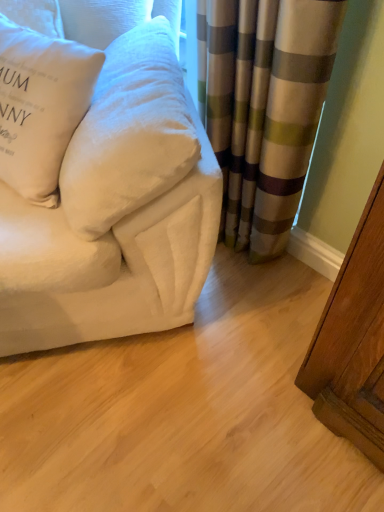
Identify the location of white velvety pillow at left, positioned as the 2th pillow in left-to-right order. Image resolution: width=384 pixels, height=512 pixels. (129, 133).

What is the approximate height of white soft pillow at upper left, which is the 1th pillow from left to right?

42.15 centimeters.

Find the location of a particular element. The width and height of the screenshot is (384, 512). white velvety pillow at left, which appears as the 1th pillow when viewed from the right is located at coordinates (129, 133).

Which is nearer, (293,69) or (3,261)?

Clearly, point (293,69) is more distant from the camera than point (3,261).

Is striped fabric curtain at center positioned behind white velvety couch at upper left?

Yes, it is.

From the image's perspective, is striped fabric curtain at center beneath white velvety couch at upper left?

Correct, striped fabric curtain at center appears lower than white velvety couch at upper left in the image.

Is striped fabric curtain at center to the left of white velvety couch at upper left from the viewer's perspective?

In fact, striped fabric curtain at center is to the right of white velvety couch at upper left.

From the image's perspective, is white velvety pillow at left, positioned as the 2th pillow in left-to-right order, below striped fabric curtain at center?

Yes, from the image's perspective, white velvety pillow at left, positioned as the 2th pillow in left-to-right order, is beneath striped fabric curtain at center.

Consider the image. Which object is wider, white velvety pillow at left, which appears as the 1th pillow when viewed from the right, or striped fabric curtain at center?

white velvety pillow at left, which appears as the 1th pillow when viewed from the right.

Is white velvety couch at upper left taller than white velvety pillow at left, positioned as the 2th pillow in left-to-right order?

Yes.

Is white velvety couch at upper left outside of white velvety pillow at left, positioned as the 2th pillow in left-to-right order?

Yes, white velvety couch at upper left is outside of white velvety pillow at left, positioned as the 2th pillow in left-to-right order.

How far apart are white velvety couch at upper left and white velvety pillow at left, positioned as the 2th pillow in left-to-right order?

The distance of white velvety couch at upper left from white velvety pillow at left, positioned as the 2th pillow in left-to-right order, is 3.25 inches.

In terms of width, does white velvety couch at upper left look wider or thinner when compared to white velvety pillow at left, positioned as the 2th pillow in left-to-right order?

Clearly, white velvety couch at upper left has more width compared to white velvety pillow at left, positioned as the 2th pillow in left-to-right order.

Is white velvety couch at upper left positioned with its back to striped fabric curtain at center?

No, white velvety couch at upper left's orientation is not away from striped fabric curtain at center.

Is white velvety couch at upper left shorter than striped fabric curtain at center?

In fact, white velvety couch at upper left may be taller than striped fabric curtain at center.

From a real-world perspective, who is located higher, white velvety couch at upper left or striped fabric curtain at center?

In real-world perspective, white velvety couch at upper left is above.

Between white velvety couch at upper left and striped fabric curtain at center, which one has larger width?

Wider between the two is white velvety couch at upper left.

Is white velvety pillow at left, which appears as the 1th pillow when viewed from the right, touching white velvety couch at upper left?

Yes, white velvety pillow at left, which appears as the 1th pillow when viewed from the right, is with white velvety couch at upper left.

Consider the image. Does white velvety pillow at left, which appears as the 1th pillow when viewed from the right, come in front of white velvety couch at upper left?

No, it is not.

From the image's perspective, is white velvety pillow at left, positioned as the 2th pillow in left-to-right order, located above white velvety couch at upper left?

No, from the image's perspective, white velvety pillow at left, positioned as the 2th pillow in left-to-right order, is not on top of white velvety couch at upper left.

From the picture: Can you confirm if white velvety pillow at left, positioned as the 2th pillow in left-to-right order, is bigger than white velvety couch at upper left?

Actually, white velvety pillow at left, positioned as the 2th pillow in left-to-right order, might be smaller than white velvety couch at upper left.

In terms of width, does striped fabric curtain at center look wider or thinner when compared to white soft pillow at upper left, marked as the 2th pillow in a right-to-left arrangement?

Clearly, striped fabric curtain at center has less width compared to white soft pillow at upper left, marked as the 2th pillow in a right-to-left arrangement.

Which pillow is the 1st one when counting from the front of the striped fabric curtain at center? Please provide its 2D coordinates.

[(40, 106)]

Does striped fabric curtain at center have a larger size compared to white soft pillow at upper left, marked as the 2th pillow in a right-to-left arrangement?

Correct, striped fabric curtain at center is larger in size than white soft pillow at upper left, marked as the 2th pillow in a right-to-left arrangement.

How many degrees apart are the facing directions of striped fabric curtain at center and white soft pillow at upper left, which is the 1th pillow from left to right?

striped fabric curtain at center and white soft pillow at upper left, which is the 1th pillow from left to right, are facing 8.65 degrees away from each other.

From a real-world perspective, which object rests below the other?

white velvety pillow at left, positioned as the 2th pillow in left-to-right order, from a real-world perspective.

Is white velvety pillow at left, which appears as the 1th pillow when viewed from the right, at the back of white soft pillow at upper left, which is the 1th pillow from left to right?

Yes, white soft pillow at upper left, which is the 1th pillow from left to right,'s orientation is away from white velvety pillow at left, which appears as the 1th pillow when viewed from the right.

Looking at this image, which is behind, white soft pillow at upper left, which is the 1th pillow from left to right, or white velvety pillow at left, which appears as the 1th pillow when viewed from the right?

white soft pillow at upper left, which is the 1th pillow from left to right, is further away from the camera.

From the image's perspective, is white soft pillow at upper left, which is the 1th pillow from left to right, located beneath white velvety pillow at left, positioned as the 2th pillow in left-to-right order?

No.

Locate an element on the screen. The height and width of the screenshot is (512, 384). curtain on the right of white velvety couch at upper left is located at coordinates (264, 106).

Locate an element on the screen. This screenshot has width=384, height=512. the 2nd pillow in front of the striped fabric curtain at center is located at coordinates (129, 133).

Estimate the real-world distances between objects in this image. Which object is further from white soft pillow at upper left, which is the 1th pillow from left to right, striped fabric curtain at center or white velvety couch at upper left?

Among the two, striped fabric curtain at center is located further to white soft pillow at upper left, which is the 1th pillow from left to right.

Estimate the real-world distances between objects in this image. Which object is further from striped fabric curtain at center, white velvety pillow at left, positioned as the 2th pillow in left-to-right order, or white velvety couch at upper left?

white velvety couch at upper left is positioned further to the anchor striped fabric curtain at center.

In the scene shown: From the image, which object appears to be farther from white velvety pillow at left, positioned as the 2th pillow in left-to-right order, white velvety couch at upper left or white soft pillow at upper left, marked as the 2th pillow in a right-to-left arrangement?

white soft pillow at upper left, marked as the 2th pillow in a right-to-left arrangement, lies further to white velvety pillow at left, positioned as the 2th pillow in left-to-right order, than the other object.

In the scene shown: Based on their spatial positions, is white velvety pillow at left, which appears as the 1th pillow when viewed from the right, or striped fabric curtain at center closer to white soft pillow at upper left, marked as the 2th pillow in a right-to-left arrangement?

white velvety pillow at left, which appears as the 1th pillow when viewed from the right, is closer to white soft pillow at upper left, marked as the 2th pillow in a right-to-left arrangement.

Based on their spatial positions, is white soft pillow at upper left, marked as the 2th pillow in a right-to-left arrangement, or striped fabric curtain at center closer to white velvety couch at upper left?

white soft pillow at upper left, marked as the 2th pillow in a right-to-left arrangement, lies closer to white velvety couch at upper left than the other object.

Considering their positions, is striped fabric curtain at center positioned further to white velvety pillow at left, positioned as the 2th pillow in left-to-right order, than white velvety couch at upper left?

striped fabric curtain at center.

Considering their positions, is white velvety couch at upper left positioned closer to white soft pillow at upper left, which is the 1th pillow from left to right, than striped fabric curtain at center?

white velvety couch at upper left.

Consider the image. Based on their spatial positions, is white soft pillow at upper left, marked as the 2th pillow in a right-to-left arrangement, or white velvety couch at upper left closer to white velvety pillow at left, which appears as the 1th pillow when viewed from the right?

white velvety couch at upper left is positioned closer to the anchor white velvety pillow at left, which appears as the 1th pillow when viewed from the right.

Identify the location of pillow between white velvety couch at upper left and striped fabric curtain at center in the horizontal direction. The width and height of the screenshot is (384, 512). point(129,133).

Find the location of a particular element. pillow between white soft pillow at upper left, marked as the 2th pillow in a right-to-left arrangement, and striped fabric curtain at center is located at coordinates (129, 133).

The height and width of the screenshot is (512, 384). I want to click on studio couch between white soft pillow at upper left, which is the 1th pillow from left to right, and striped fabric curtain at center from left to right, so click(x=116, y=212).

Where is `studio couch situated between white soft pillow at upper left, which is the 1th pillow from left to right, and white velvety pillow at left, positioned as the 2th pillow in left-to-right order, from left to right`? This screenshot has height=512, width=384. studio couch situated between white soft pillow at upper left, which is the 1th pillow from left to right, and white velvety pillow at left, positioned as the 2th pillow in left-to-right order, from left to right is located at coordinates (116, 212).